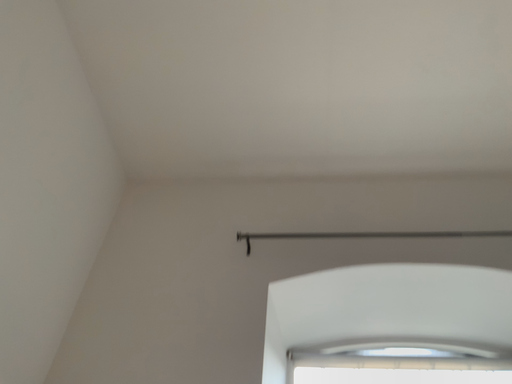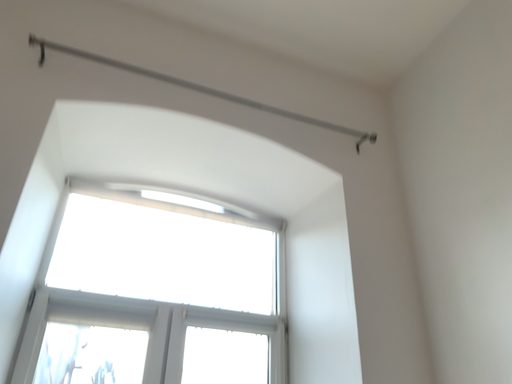
Question: How did the camera likely rotate when shooting the video?

Choices:
 (A) rotated upward
 (B) rotated downward

Answer: (B)